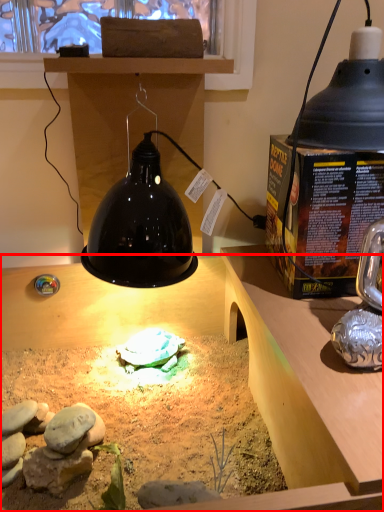
Question: From the image's perspective, where is desk (annotated by the red box) located relative to lamp?

Choices:
 (A) above
 (B) below

Answer: (B)